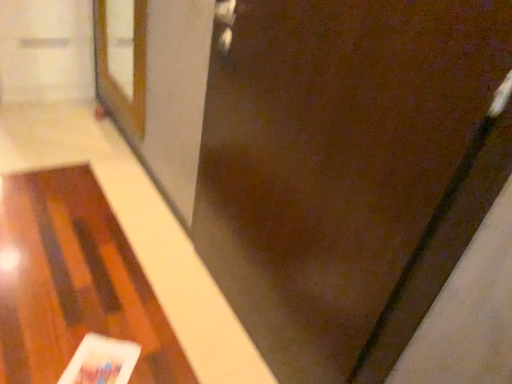
Question: Looking at their shapes, would you say brown matte door at center is wider or thinner than wooden table at lower left?

Choices:
 (A) thin
 (B) wide

Answer: (A)

Question: Based on their positions, is brown matte door at center located to the left or right of wooden table at lower left?

Choices:
 (A) left
 (B) right

Answer: (B)

Question: Estimate the real-world distances between objects in this image. Which object is farther from the wooden table at lower left?

Choices:
 (A) white glossy magazine at lower left
 (B) brown wooden screen door at upper left
 (C) brown matte door at center

Answer: (B)

Question: Estimate the real-world distances between objects in this image. Which object is farther from the wooden table at lower left?

Choices:
 (A) brown wooden screen door at upper left
 (B) white glossy magazine at lower left
 (C) brown matte door at center

Answer: (A)